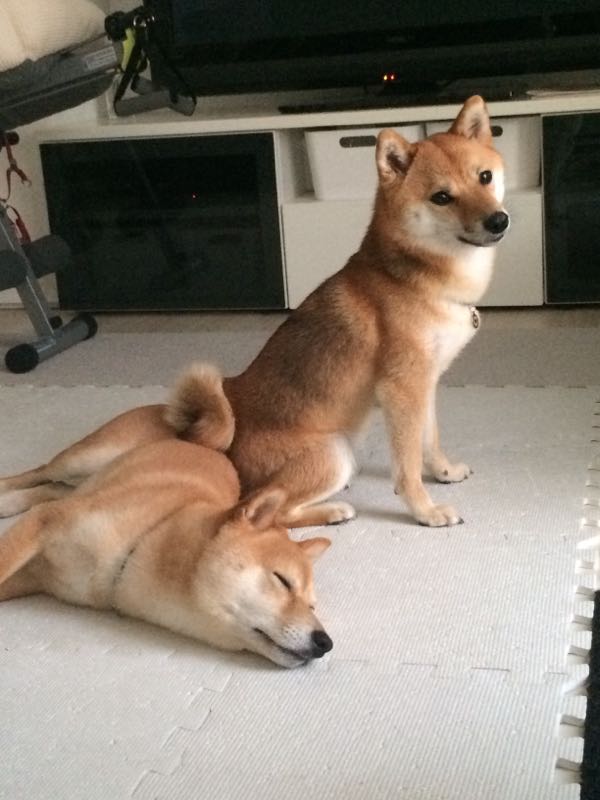
Find the location of a particular element. exercise machine is located at coordinates (33, 290).